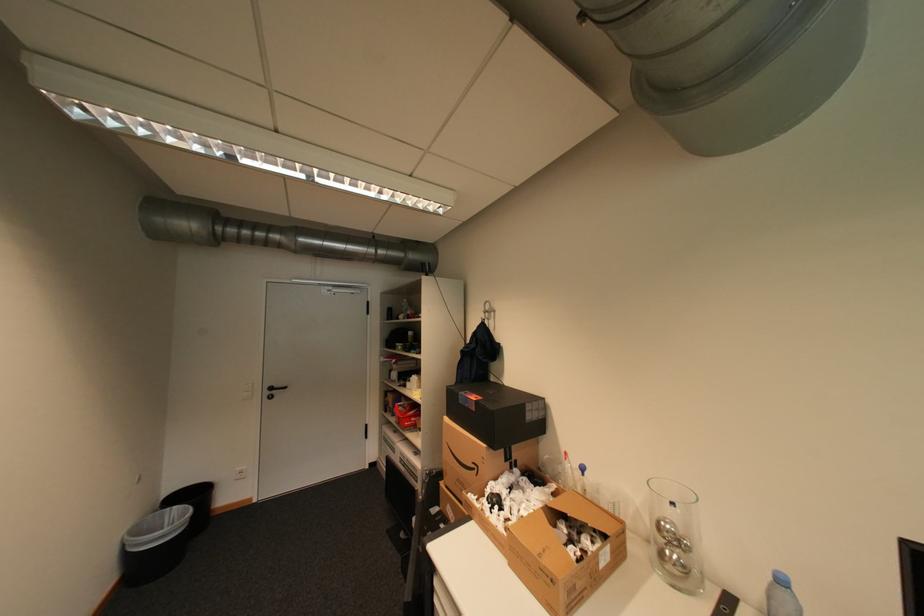
This screenshot has width=924, height=616. Describe the element at coordinates (782, 596) in the screenshot. I see `the blue bottle cap` at that location.